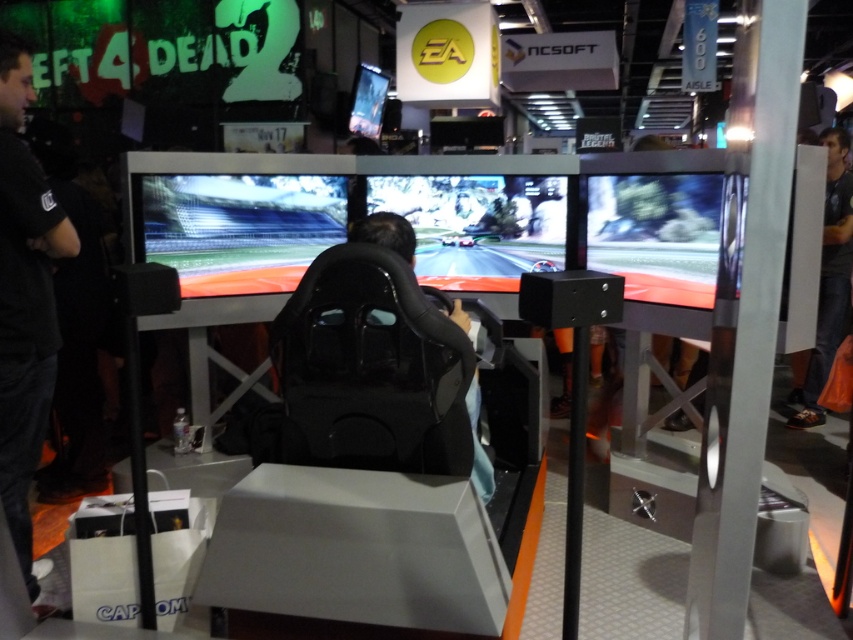
Question: Which point is closer to the camera?

Choices:
 (A) dark gray fabric at right
 (B) black fabric shirt at left

Answer: (B)

Question: Can you confirm if dark gray fabric at right is positioned to the right of black leather chair at center?

Choices:
 (A) yes
 (B) no

Answer: (A)

Question: Can you confirm if black fabric shirt at left is positioned to the left of black leather chair at center?

Choices:
 (A) yes
 (B) no

Answer: (A)

Question: Does dark gray fabric at right appear over black leather chair at center?

Choices:
 (A) no
 (B) yes

Answer: (B)

Question: Estimate the real-world distances between objects in this image. Which object is closer to the black fabric shirt at left?

Choices:
 (A) dark gray fabric at right
 (B) black leather chair at center

Answer: (B)

Question: Which object is the farthest from the dark gray fabric at right?

Choices:
 (A) black leather chair at center
 (B) black fabric shirt at left

Answer: (B)